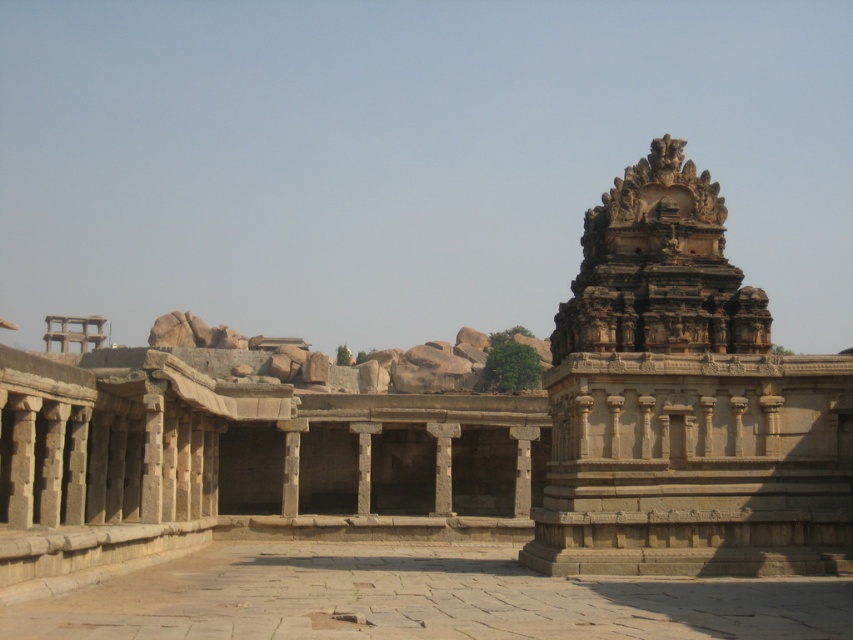
Question: Considering the real-world distances, which object is farthest from the stone temple at right?

Choices:
 (A) stone temple at center
 (B) smooth stone courtyard at center

Answer: (A)

Question: Does stone temple at right appear on the right side of smooth stone courtyard at center?

Choices:
 (A) no
 (B) yes

Answer: (B)

Question: Is stone temple at center further to the viewer compared to smooth stone courtyard at center?

Choices:
 (A) no
 (B) yes

Answer: (B)

Question: In this image, where is stone temple at right located relative to smooth stone courtyard at center?

Choices:
 (A) right
 (B) left

Answer: (A)

Question: Which object is the closest to the stone temple at right?

Choices:
 (A) stone temple at center
 (B) smooth stone courtyard at center

Answer: (B)

Question: Which point is farther to the camera?

Choices:
 (A) stone temple at center
 (B) stone temple at right

Answer: (B)